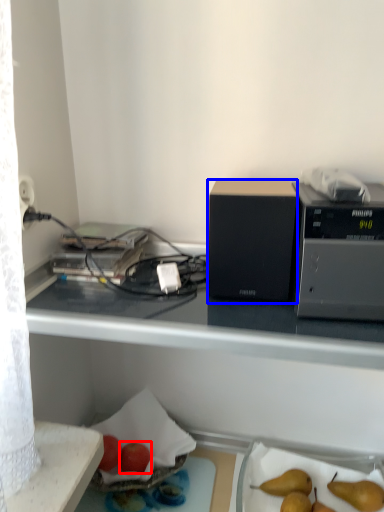
Question: Which object appears farthest to the camera in this image, apple (highlighted by a red box) or appliance (highlighted by a blue box)?

Choices:
 (A) apple
 (B) appliance

Answer: (A)